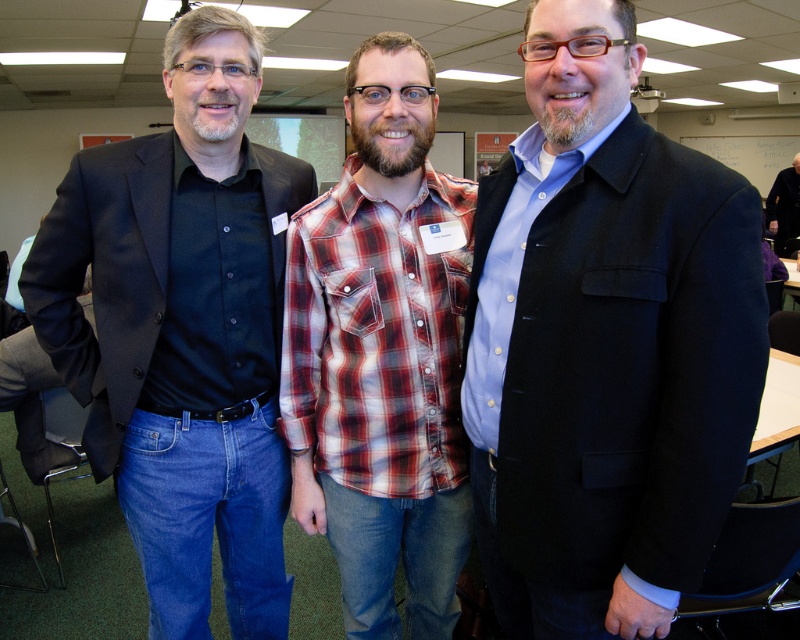
Question: Does matte black shirt at left have a smaller size compared to plaid cotton shirt at center?

Choices:
 (A) yes
 (B) no

Answer: (B)

Question: Which object appears farthest from the camera in this image?

Choices:
 (A) dark gray sweater at right
 (B) matte black coat at center
 (C) matte black shirt at left

Answer: (A)

Question: Which point appears closest to the camera in this image?

Choices:
 (A) (366, 563)
 (B) (784, 186)

Answer: (A)

Question: Among these points, which one is farthest from the camera?

Choices:
 (A) (529, 436)
 (B) (394, 410)
 (C) (784, 182)

Answer: (C)

Question: Is plaid cotton shirt at center smaller than dark gray sweater at right?

Choices:
 (A) yes
 (B) no

Answer: (A)

Question: Does plaid cotton shirt at center appear on the right side of dark gray sweater at right?

Choices:
 (A) yes
 (B) no

Answer: (B)